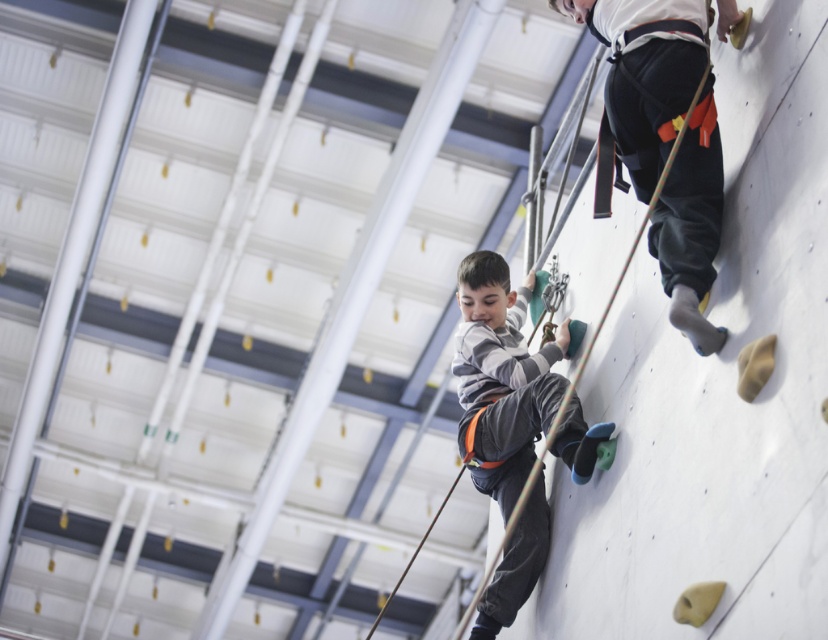
You are a beginner climber looking at the climbing wall. There is a point marked at coordinates [644,72] on the wall. What object is located at that point?

The point at coordinates [644,72] corresponds to black fabric pants at upper right.

You are observing two climbers in the rock climbing facility. You notice the black fabric pants at upper right and the gray fabric pants at center. Which climber is shorter in height?

The black fabric pants at upper right is not as tall as gray fabric pants at center, so the climber wearing the black fabric pants at upper right is shorter in height.

You are a safety inspector checking the climbing wall. You notice two climbers wearing black fabric pants at upper right and gray fabric pants at center. Which climber is closer to the top of the wall?

The black fabric pants at upper right is in front of gray fabric pants at center, meaning the climber in black fabric pants at upper right is closer to the top of the wall.